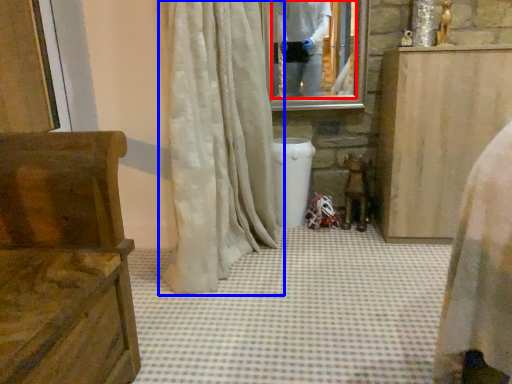
Question: Which object appears farthest to the camera in this image, mirror (highlighted by a red box) or curtain (highlighted by a blue box)?

Choices:
 (A) mirror
 (B) curtain

Answer: (A)